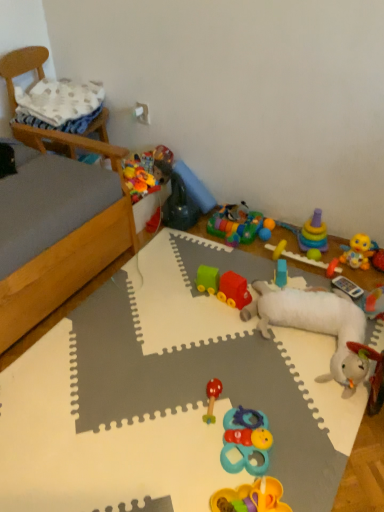
Locate an element on the screen. The height and width of the screenshot is (512, 384). unoccupied area behind rubberized plastic train at center, the 7th toy when ordered from top to bottom is located at coordinates (225, 262).